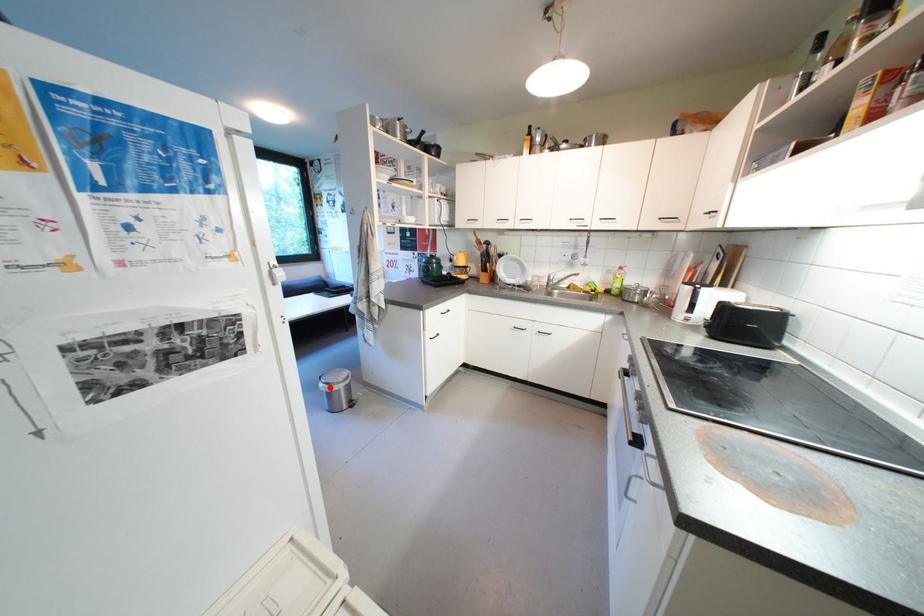
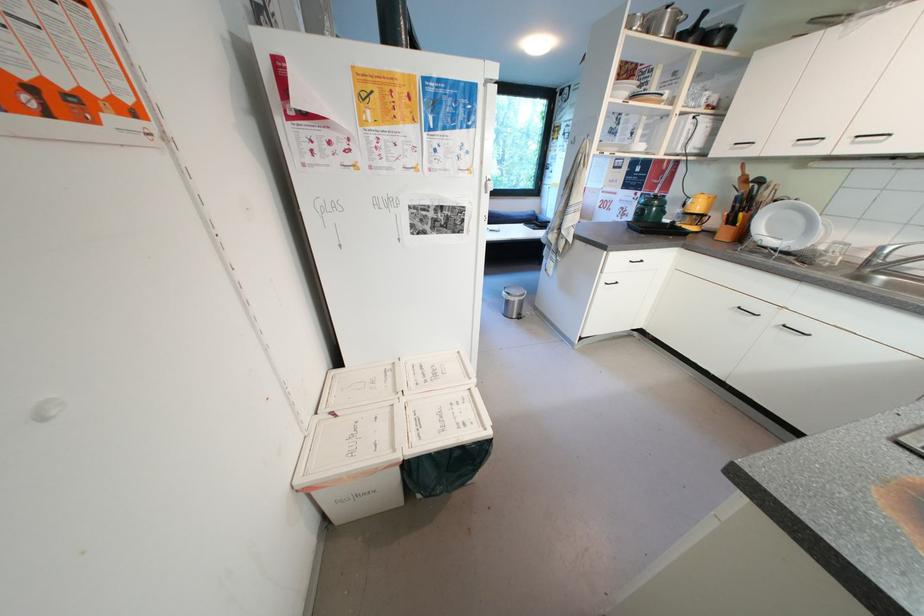
In the second image, find the point that corresponds to the highlighted location in the first image.

(512, 294)